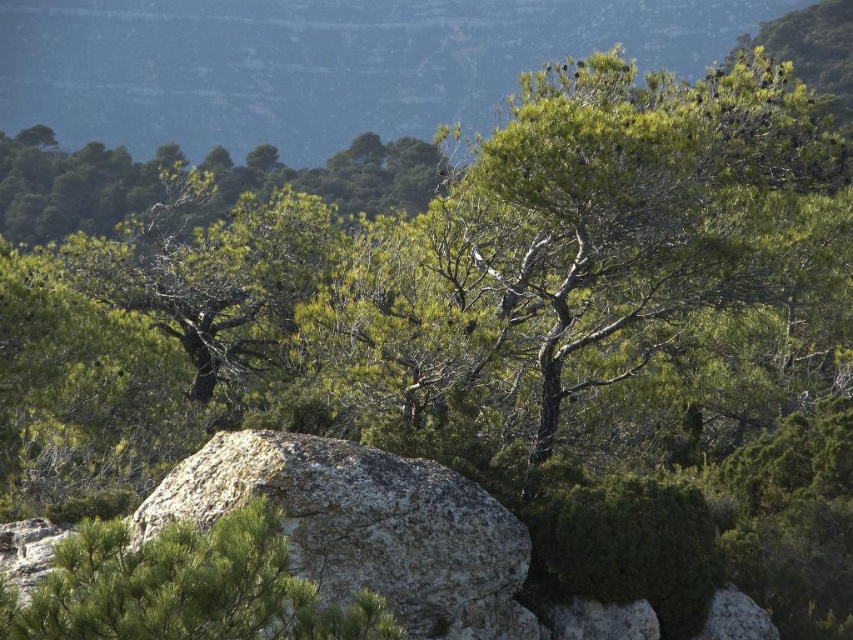
Can you confirm if rough textured rock at center is positioned to the right of green leafy tree at center?

Correct, you'll find rough textured rock at center to the right of green leafy tree at center.

Is rough textured rock at center above green leafy tree at center?

No, rough textured rock at center is not above green leafy tree at center.

This screenshot has height=640, width=853. I want to click on rough textured rock at center, so click(364, 528).

I want to click on rough textured rock at center, so click(364, 528).

Who is higher up, green leafy tree at center or green leafy tree at left?

green leafy tree at left is higher up.

Is green leafy tree at center wider than green leafy tree at left?

Incorrect, green leafy tree at center's width does not surpass green leafy tree at left's.

Describe the element at coordinates (184, 588) in the screenshot. This screenshot has height=640, width=853. I see `green leafy tree at center` at that location.

Find the location of a particular element. green leafy tree at center is located at coordinates (184, 588).

Is point (375, 520) positioned behind point (350, 150)?

No, (375, 520) is closer to viewer.

Describe the element at coordinates (364, 528) in the screenshot. The image size is (853, 640). I see `rough textured rock at center` at that location.

Locate an element on the screen. This screenshot has height=640, width=853. rough textured rock at center is located at coordinates (364, 528).